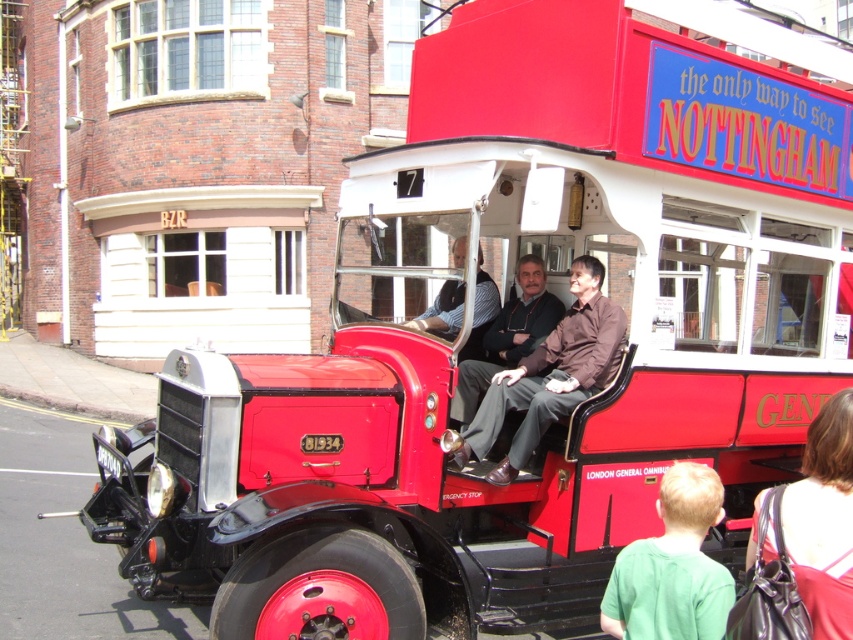
Question: Does red leather handbag at lower right have a lesser width compared to striped shirt at center?

Choices:
 (A) yes
 (B) no

Answer: (A)

Question: From the image, what is the correct spatial relationship of green matte shirt at lower right in relation to striped shirt at center?

Choices:
 (A) left
 (B) right

Answer: (B)

Question: Which of the following is the closest to the observer?

Choices:
 (A) brown smooth shirt at center
 (B) striped shirt at center

Answer: (A)

Question: Which of the following is the closest to the observer?

Choices:
 (A) striped shirt at center
 (B) red leather handbag at lower right
 (C) brown smooth shirt at center

Answer: (B)

Question: Estimate the real-world distances between objects in this image. Which object is farther from the striped shirt at center?

Choices:
 (A) red leather handbag at lower right
 (B) matte black jacket at center
 (C) brown smooth shirt at center

Answer: (A)

Question: Does red leather handbag at lower right have a larger size compared to matte black jacket at center?

Choices:
 (A) yes
 (B) no

Answer: (B)